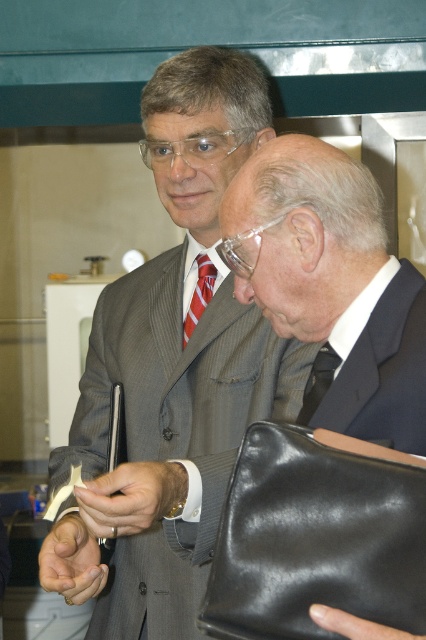
Question: Does matte black wristwatch at center have a smaller size compared to red striped tie at center?

Choices:
 (A) no
 (B) yes

Answer: (A)

Question: Can you confirm if dark blue silk tie at center is positioned to the left of red striped tie at center?

Choices:
 (A) no
 (B) yes

Answer: (A)

Question: Does matte black wristwatch at center appear on the left side of dark blue silk tie at center?

Choices:
 (A) yes
 (B) no

Answer: (A)

Question: Which of these objects is positioned closest to the dark blue silk tie at center?

Choices:
 (A) matte black wristwatch at center
 (B) red striped tie at center

Answer: (A)

Question: Which of the following is the closest to the observer?

Choices:
 (A) (324, 384)
 (B) (325, 420)
 (C) (169, 448)
 (D) (198, 253)

Answer: (B)

Question: Which point is farther to the camera?

Choices:
 (A) smooth skin hand at center
 (B) matte black wristwatch at center
 (C) dark blue silk tie at center
 (D) red striped tie at center

Answer: (D)